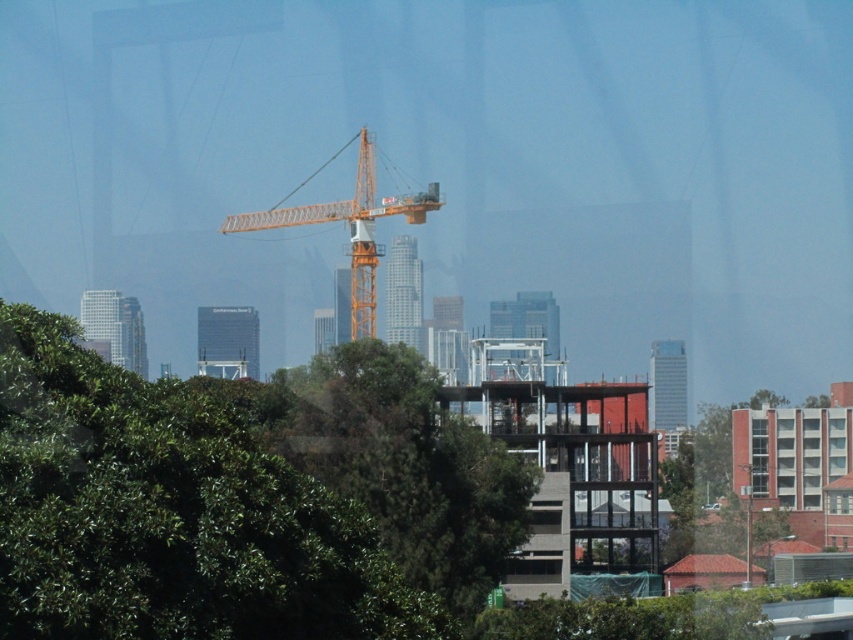
Question: Among these points, which one is nearest to the camera?

Choices:
 (A) (213, 576)
 (B) (358, 282)

Answer: (A)

Question: Which object appears closest to the camera in this image?

Choices:
 (A) orange metallic crane at center
 (B) green leafy tree at center

Answer: (B)

Question: In this image, where is green leafy tree at center located relative to orange metallic crane at center?

Choices:
 (A) above
 (B) below

Answer: (B)

Question: Is green leafy tree at center bigger than orange metallic crane at center?

Choices:
 (A) yes
 (B) no

Answer: (B)

Question: Is green leafy tree at center smaller than orange metallic crane at center?

Choices:
 (A) yes
 (B) no

Answer: (A)